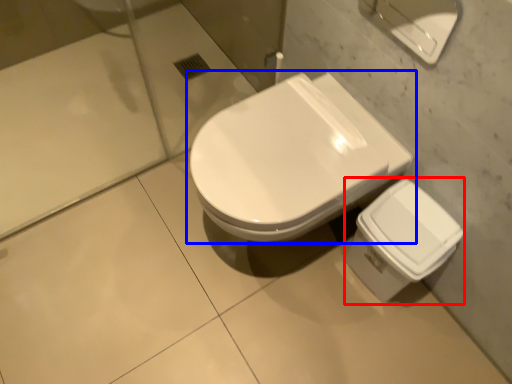
Question: Which object is closer to the camera taking this photo, porcelain (highlighted by a red box) or toilet (highlighted by a blue box)?

Choices:
 (A) porcelain
 (B) toilet

Answer: (B)